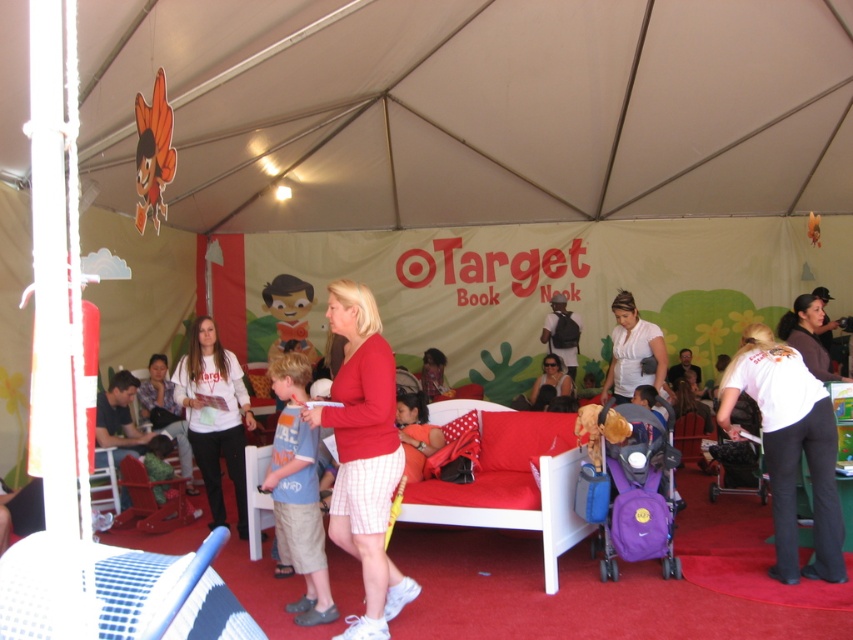
Is red matte shorts at center above white cotton shirt at lower right?

Indeed, red matte shorts at center is positioned over white cotton shirt at lower right.

Is point (340, 392) closer to camera compared to point (840, 529)?

Yes, point (340, 392) is in front of point (840, 529).

The height and width of the screenshot is (640, 853). I want to click on red matte shorts at center, so click(364, 456).

Where is `red matte shorts at center`? This screenshot has height=640, width=853. red matte shorts at center is located at coordinates (364, 456).

Is the position of white cotton shirt at lower right less distant than that of white matte sweatshirt at center?

Yes, it is in front of white matte sweatshirt at center.

Is point (740, 348) positioned before point (224, 426)?

Yes.

You are a GUI agent. You are given a task and a screenshot of the screen. Output one action in this format:
    pyautogui.click(x=<x>, y=<y>)
    Task: Click on the white cotton shirt at lower right
    This screenshot has height=640, width=853.
    Given the screenshot: What is the action you would take?
    pyautogui.click(x=788, y=445)

At what (x,y) coordinates should I click in order to perform the action: click on red matte shorts at center. Please return your answer as a coordinate pair (x, y). Image resolution: width=853 pixels, height=640 pixels. Looking at the image, I should click on (364, 456).

Is red matte shorts at center smaller than blue cotton shirt at center?

No.

Does point (321, 419) come closer to viewer compared to point (315, 621)?

Yes, it is in front of point (315, 621).

This screenshot has width=853, height=640. I want to click on red matte shorts at center, so click(x=364, y=456).